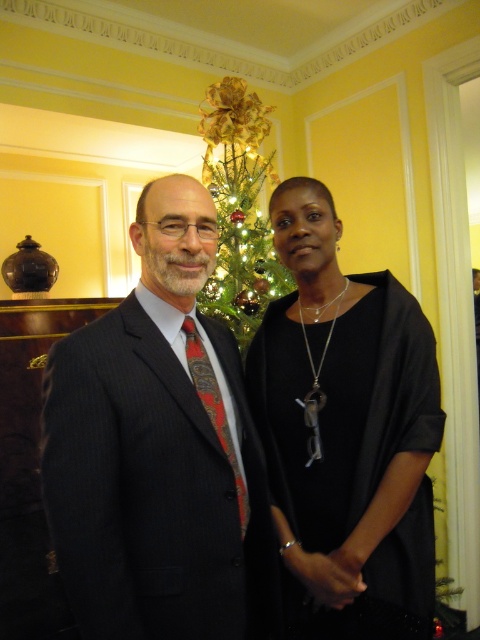
Based on the photo, is dark pinstripe suit at center to the left of paisley silk tie at center from the viewer's perspective?

Indeed, dark pinstripe suit at center is positioned on the left side of paisley silk tie at center.

In the scene shown: Which of these two, dark pinstripe suit at center or paisley silk tie at center, stands shorter?

paisley silk tie at center is shorter.

Does point (171, 365) come in front of point (208, 397)?

Yes, point (171, 365) is closer to viewer.

I want to click on dark pinstripe suit at center, so click(158, 451).

Does dark pinstripe suit at center have a greater width compared to green shiny christmas tree at center?

Yes.

Who is lower down, dark pinstripe suit at center or green shiny christmas tree at center?

dark pinstripe suit at center is lower down.

Is point (247, 524) farther from camera compared to point (203, 104)?

No.

Locate an element on the screen. This screenshot has width=480, height=640. dark pinstripe suit at center is located at coordinates (158, 451).

Is black matte dress at center thinner than green shiny christmas tree at center?

Indeed, black matte dress at center has a lesser width compared to green shiny christmas tree at center.

Does point (432, 509) lie behind point (253, 128)?

That is False.

Is point (358, 301) more distant than point (240, 124)?

No, (358, 301) is closer to viewer.

I want to click on black matte dress at center, so click(346, 433).